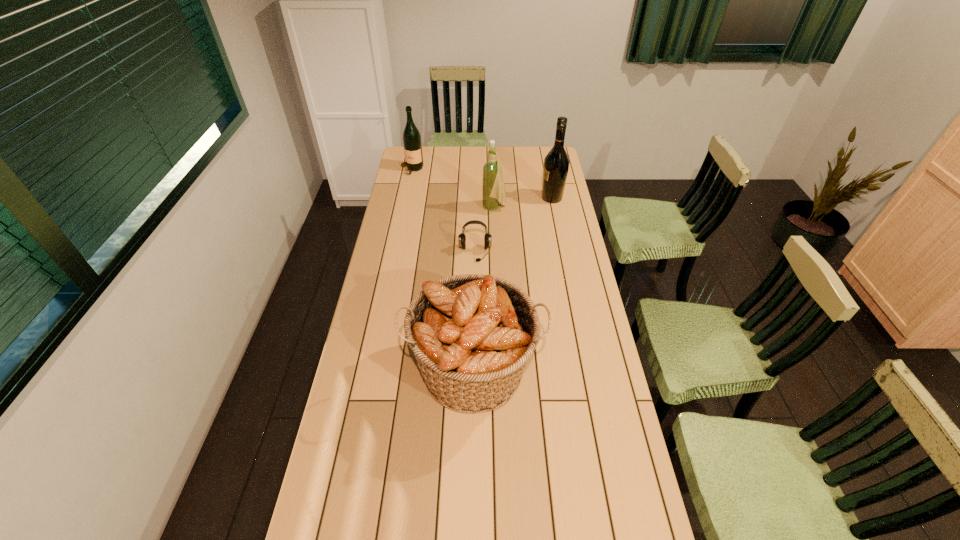
Locate an element on the screen. The height and width of the screenshot is (540, 960). the tallest object is located at coordinates (556, 163).

Locate an element on the screen. the tallest wine bottle is located at coordinates (556, 163).

Identify the location of the second wine bottle from right to left. The height and width of the screenshot is (540, 960). (493, 192).

Locate an element on the screen. This screenshot has height=540, width=960. the leftmost wine bottle is located at coordinates 412,143.

Identify the location of the leftmost object. The width and height of the screenshot is (960, 540). 412,143.

Where is `basket`? The height and width of the screenshot is (540, 960). basket is located at coordinates (472, 334).

What are the coordinates of `the fourth farthest object` in the screenshot? It's located at (462, 238).

Locate an element on the screen. The width and height of the screenshot is (960, 540). the shortest object is located at coordinates (462, 238).

This screenshot has width=960, height=540. Identify the location of free space located on the label of the tallest object. (527, 198).

Image resolution: width=960 pixels, height=540 pixels. I want to click on vacant space located 0.170m on the label of the tallest object, so click(x=504, y=198).